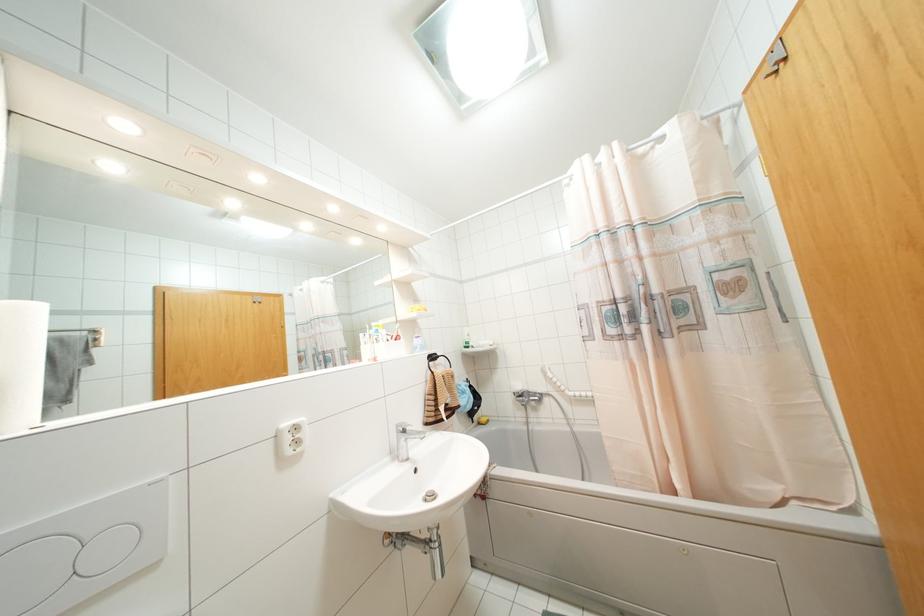
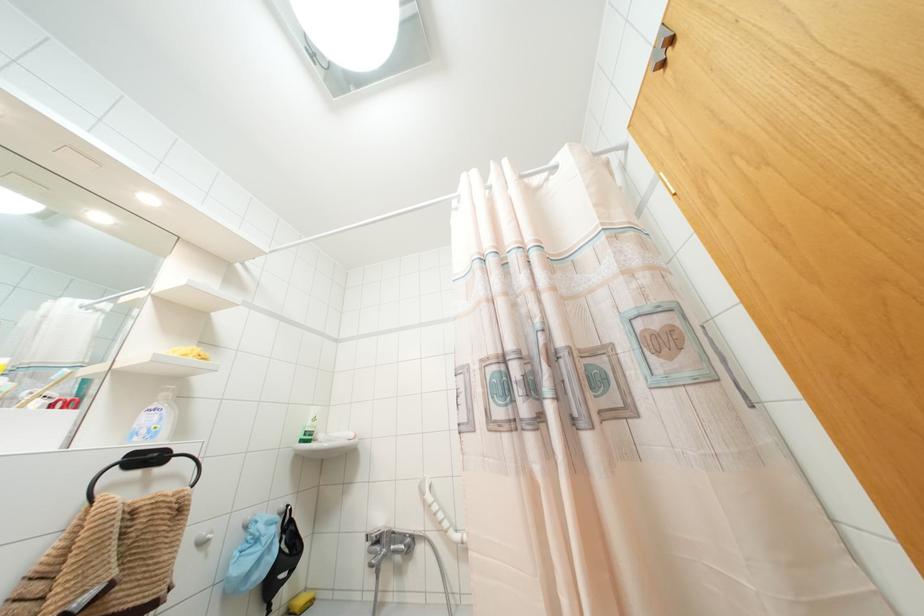
Question: How did the camera likely rotate?

Choices:
 (A) Left
 (B) Right
 (C) Up
 (D) Down

Answer: (C)